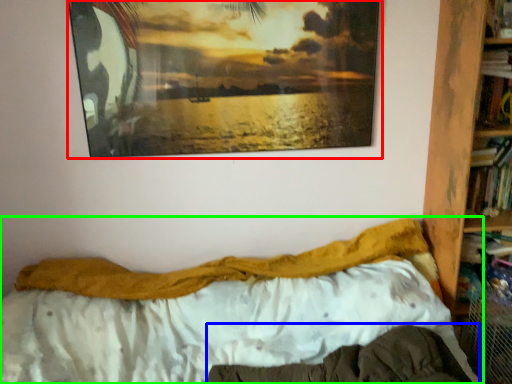
Question: Based on their relative distances, which object is farther from picture frame (highlighted by a red box)? Choose from mattress (highlighted by a blue box) and bed (highlighted by a green box).

Choices:
 (A) mattress
 (B) bed

Answer: (A)